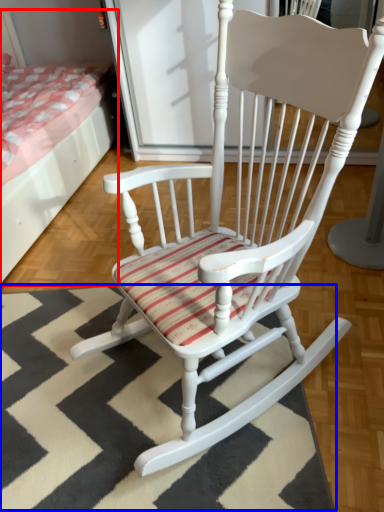
Question: Which object is closer to the camera taking this photo, bed (highlighted by a red box) or doormat (highlighted by a blue box)?

Choices:
 (A) bed
 (B) doormat

Answer: (B)